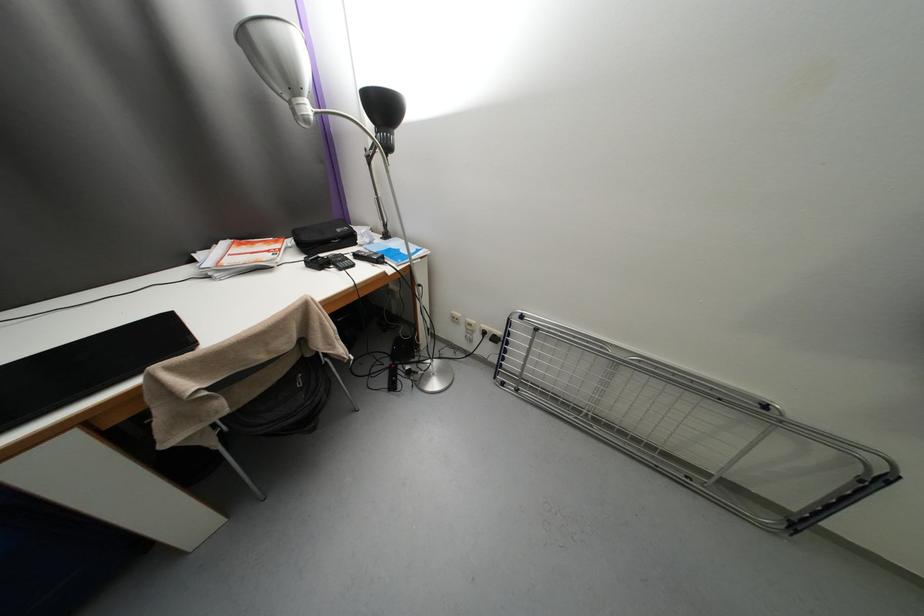
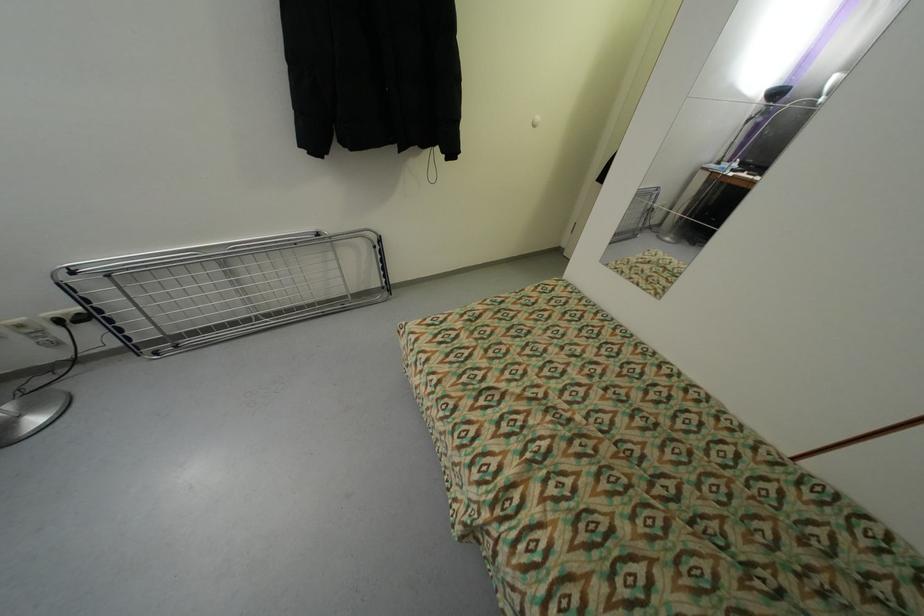
In the second image, find the point that corresponds to (501,339) in the first image.

(89, 320)